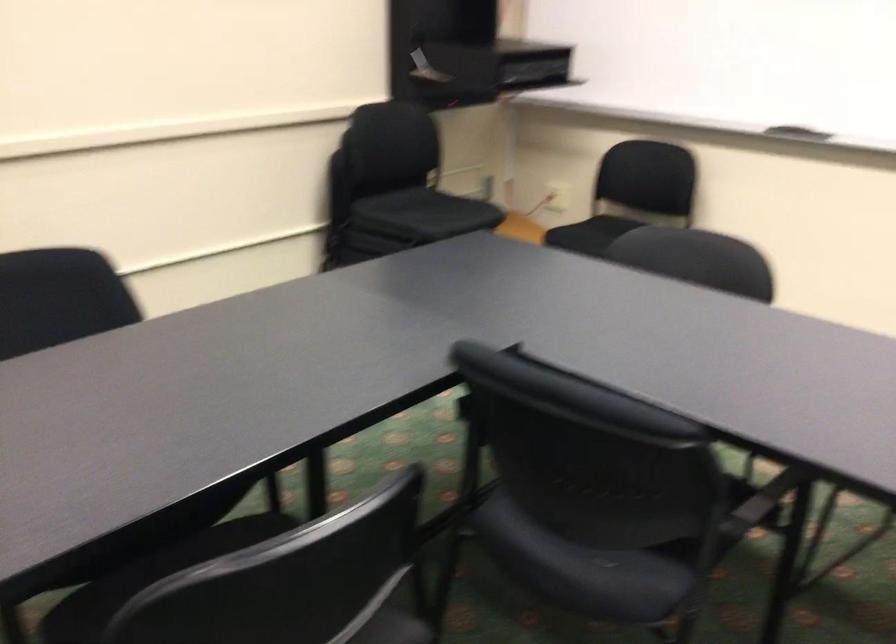
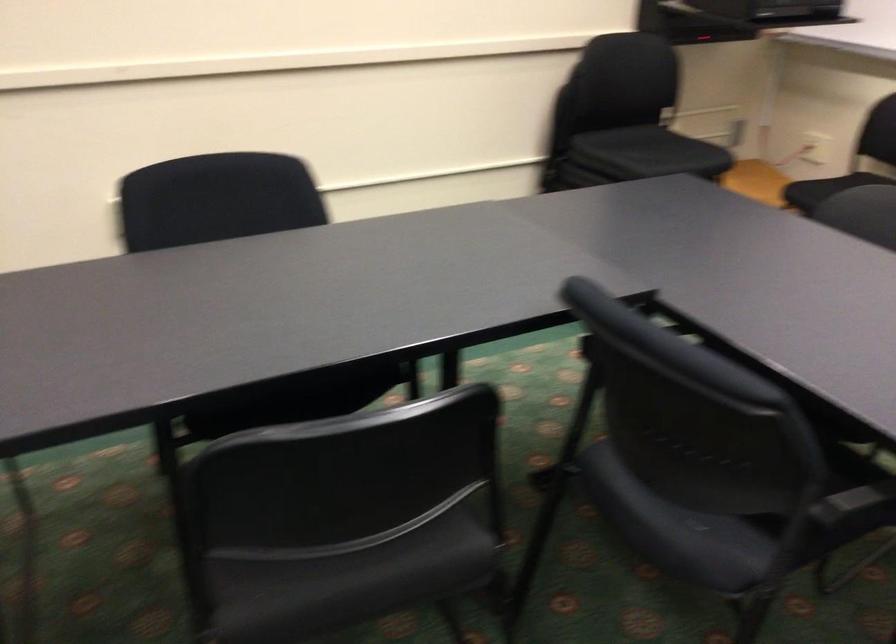
Locate, in the second image, the point that corresponds to (427,211) in the first image.

(650, 152)